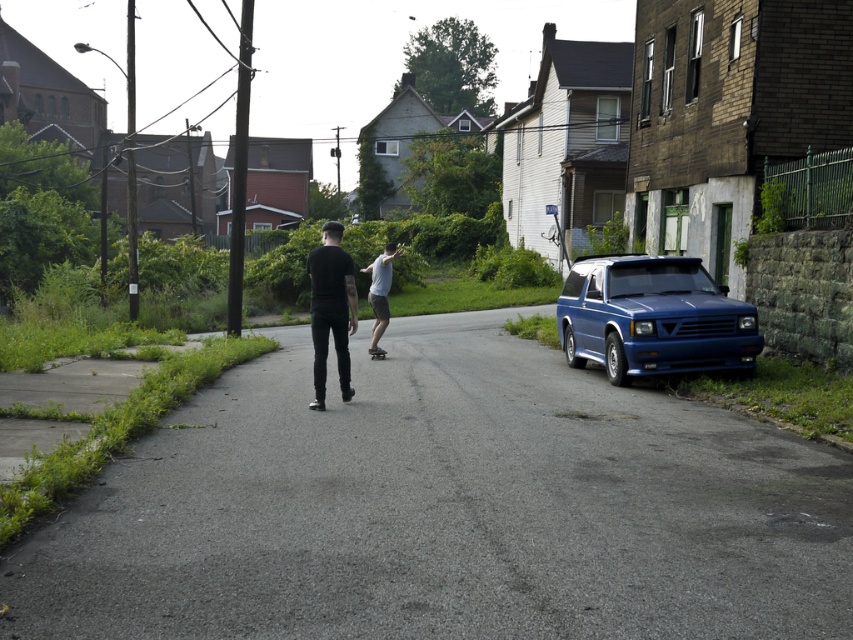
Question: Which object is the closest to the black smooth skateboard at center?

Choices:
 (A) light gray smooth skateboard at center
 (B) black matte pants at center
 (C) smooth asphalt road at center
 (D) blue metallic suv at right

Answer: (A)

Question: Can you confirm if smooth asphalt road at center is positioned below black smooth skateboard at center?

Choices:
 (A) yes
 (B) no

Answer: (A)

Question: Estimate the real-world distances between objects in this image. Which object is closer to the black matte pants at center?

Choices:
 (A) black smooth skateboard at center
 (B) light gray smooth skateboard at center
 (C) blue metallic suv at right
 (D) smooth asphalt road at center

Answer: (D)

Question: Is black matte pants at center bigger than black smooth skateboard at center?

Choices:
 (A) yes
 (B) no

Answer: (A)

Question: In this image, where is black matte pants at center located relative to light gray smooth skateboard at center?

Choices:
 (A) left
 (B) right

Answer: (B)

Question: Estimate the real-world distances between objects in this image. Which object is farther from the light gray smooth skateboard at center?

Choices:
 (A) black matte pants at center
 (B) smooth asphalt road at center

Answer: (A)